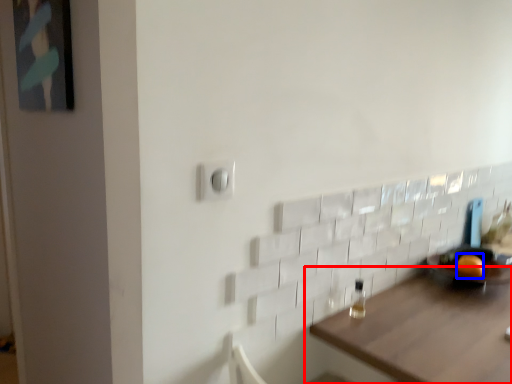
Question: Which point is further to the camera, table (highlighted by a red box) or orange (highlighted by a blue box)?

Choices:
 (A) table
 (B) orange

Answer: (B)